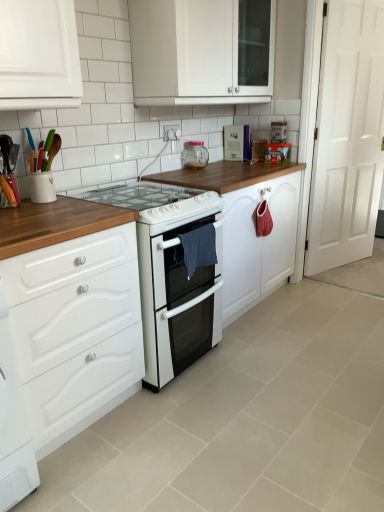
Identify the location of vacant area that is situated to the right of white glossy electric stove at center, which is the first appliance in front-to-back order. This screenshot has height=512, width=384. (259, 367).